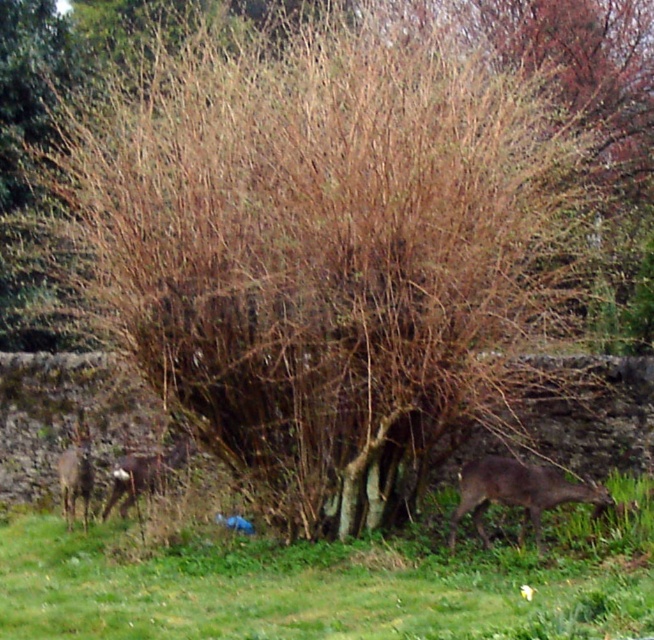
Is green grass at lower center positioned in front of brown furry deer at left?

Yes, green grass at lower center is closer to the viewer.

Locate an element on the screen. green grass at lower center is located at coordinates (305, 592).

This screenshot has height=640, width=654. In order to click on green grass at lower center in this screenshot , I will do click(x=305, y=592).

Does brown furry deer at center have a greater width compared to brown furry deer at left?

Correct, the width of brown furry deer at center exceeds that of brown furry deer at left.

Is point (118, 486) positioned before point (61, 492)?

Yes, point (118, 486) is closer to viewer.

Where is `brown furry deer at center`? The height and width of the screenshot is (640, 654). brown furry deer at center is located at coordinates (143, 474).

Between green grass at lower center and brown furry deer at lower right, which one has more height?

Standing taller between the two is brown furry deer at lower right.

Can you confirm if green grass at lower center is wider than brown furry deer at lower right?

Yes, green grass at lower center is wider than brown furry deer at lower right.

The image size is (654, 640). What do you see at coordinates (305, 592) in the screenshot?
I see `green grass at lower center` at bounding box center [305, 592].

At what (x,y) coordinates should I click in order to perform the action: click on green grass at lower center. Please return your answer as a coordinate pair (x, y). Looking at the image, I should click on (305, 592).